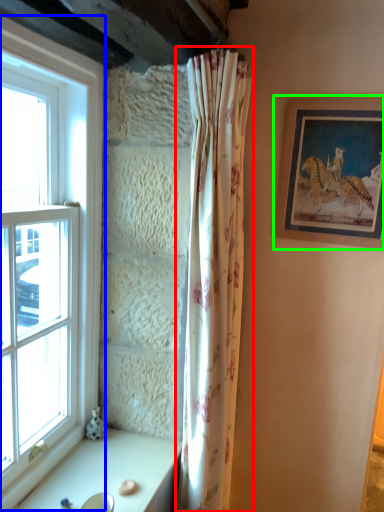
Question: Based on their relative distances, which object is nearer to curtain (highlighted by a red box)? Choose from window (highlighted by a blue box) and picture frame (highlighted by a green box).

Choices:
 (A) window
 (B) picture frame

Answer: (B)